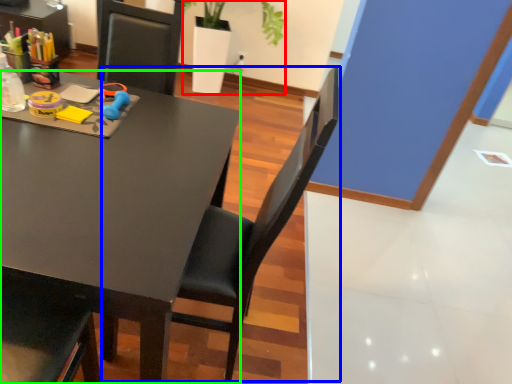
Question: Which object is the closest to the houseplant (highlighted by a red box)? Choose among these: chair (highlighted by a blue box) or desk (highlighted by a green box).

Choices:
 (A) chair
 (B) desk

Answer: (B)